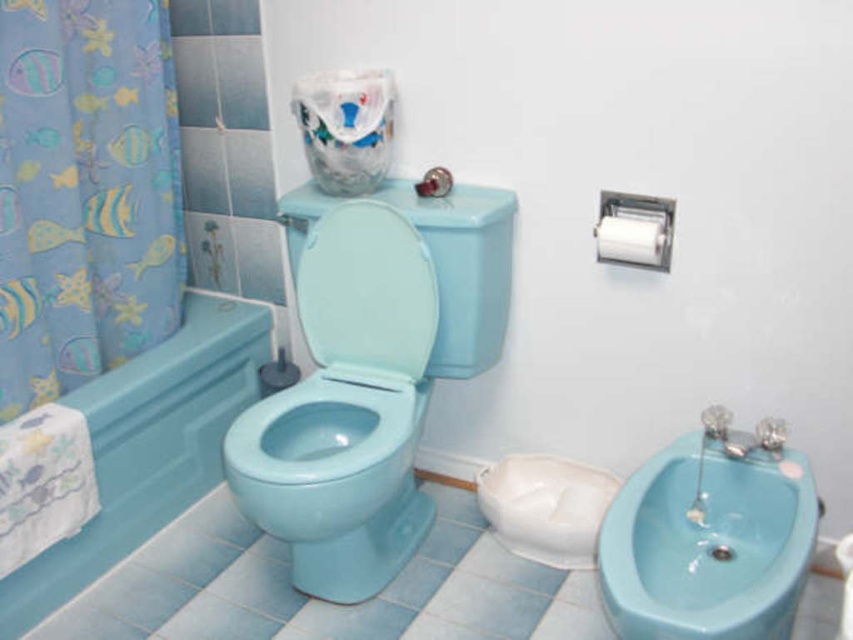
Question: Which point is farther to the camera?

Choices:
 (A) matte blue bidet at center
 (B) fish-patterned fabric at left
 (C) matte ceramic bathtub at lower left
 (D) matte blue bidet at lower right

Answer: (C)

Question: Where is fish-patterned fabric at left located in relation to matte blue bidet at center in the image?

Choices:
 (A) above
 (B) below

Answer: (A)

Question: Can you confirm if fish-patterned fabric at left is positioned to the left of matte blue bidet at center?

Choices:
 (A) no
 (B) yes

Answer: (B)

Question: Which point is farther from the camera taking this photo?

Choices:
 (A) (695, 560)
 (B) (120, 400)
 (C) (326, 387)
 (D) (106, 328)

Answer: (D)

Question: Which point is closer to the camera?

Choices:
 (A) (96, 413)
 (B) (177, 230)

Answer: (A)

Question: Does matte ceramic bathtub at lower left appear on the left side of matte blue bidet at center?

Choices:
 (A) yes
 (B) no

Answer: (A)